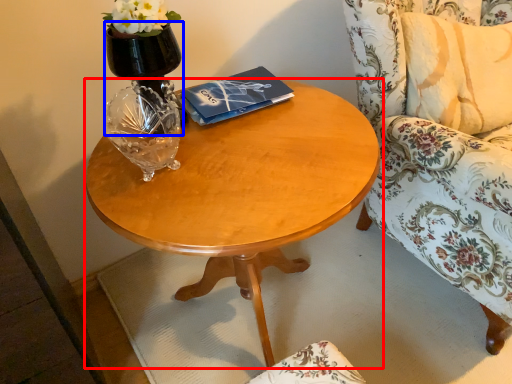
Question: Which object is closer to the camera taking this photo, coffee table (highlighted by a red box) or vase (highlighted by a blue box)?

Choices:
 (A) coffee table
 (B) vase

Answer: (A)